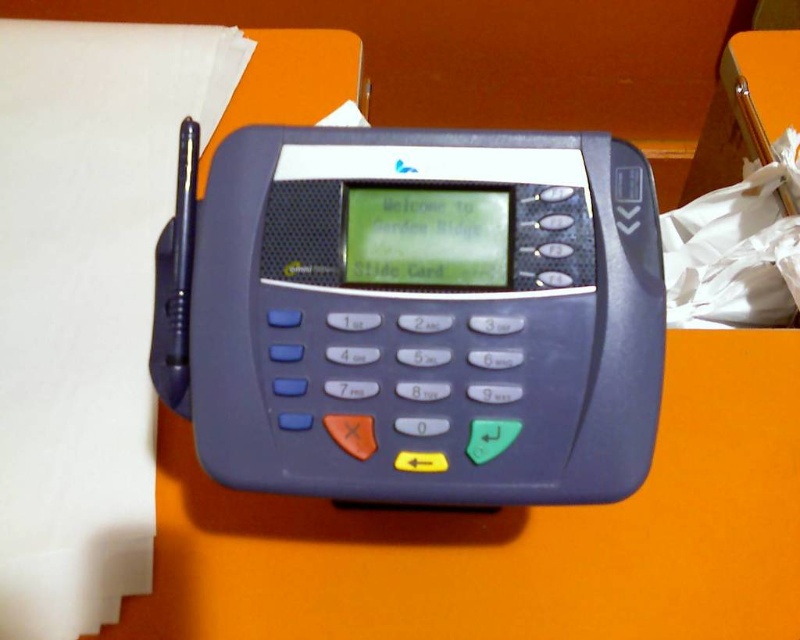
Question: Which object appears farthest from the camera in this image?

Choices:
 (A) white paper at left
 (B) orange matte table at center
 (C) matte plastic card reader at center

Answer: (B)

Question: Does orange matte table at center appear on the right side of white paper at left?

Choices:
 (A) yes
 (B) no

Answer: (A)

Question: Is orange matte table at center below white paper at left?

Choices:
 (A) yes
 (B) no

Answer: (A)

Question: Which point is farther from the camera taking this photo?

Choices:
 (A) (344, 388)
 (B) (42, 513)
 (C) (758, 529)

Answer: (C)

Question: Which point is closer to the camera?

Choices:
 (A) (146, 209)
 (B) (684, 484)
 (C) (388, 445)

Answer: (C)

Question: Does matte plastic card reader at center appear over white paper at left?

Choices:
 (A) yes
 (B) no

Answer: (B)